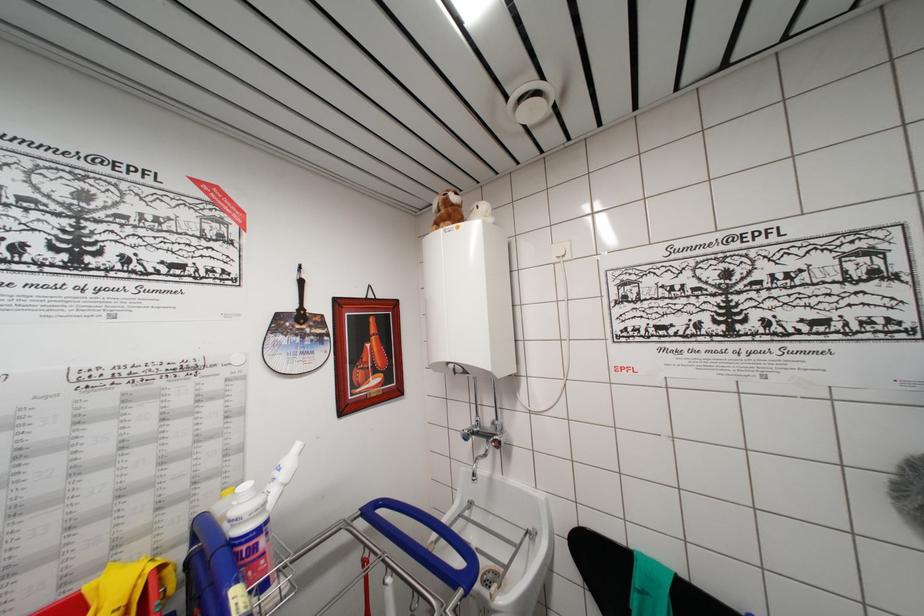
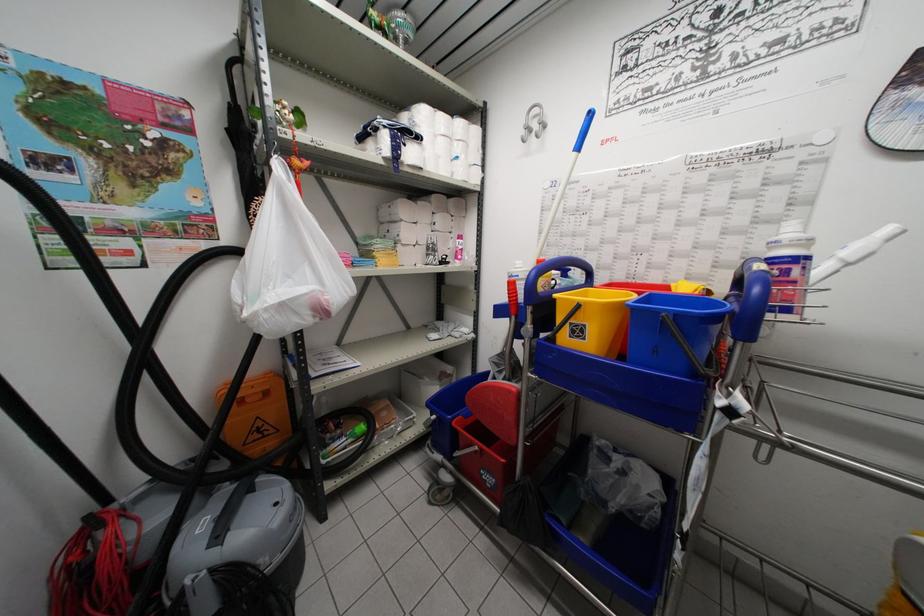
The first image is from the beginning of the video and the second image is from the end. How did the camera likely rotate when shooting the video?

The rotation direction of the camera is left-down.